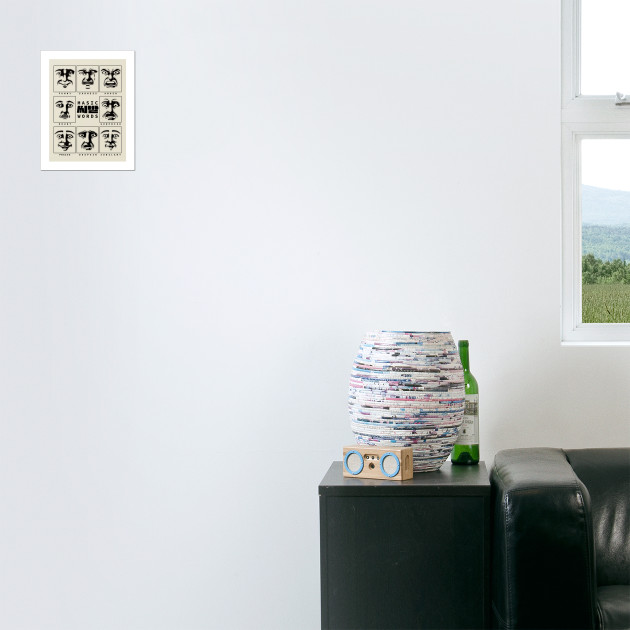
At what (x,y) coordinates should I click in order to perform the action: click on speakers of small radio. Please return your answer as a coordinate pair (x, y). The image size is (630, 630). Looking at the image, I should click on (356, 462), (390, 462).